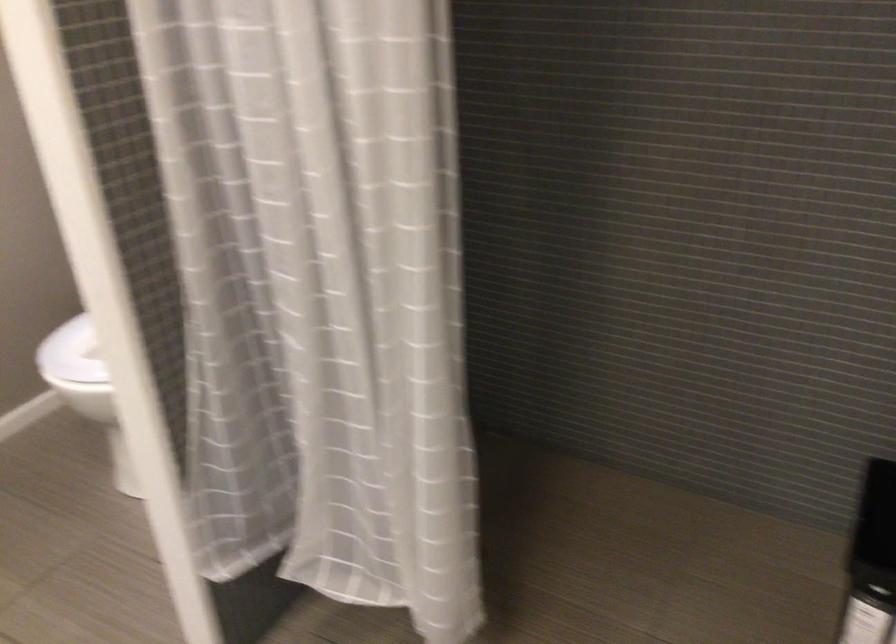
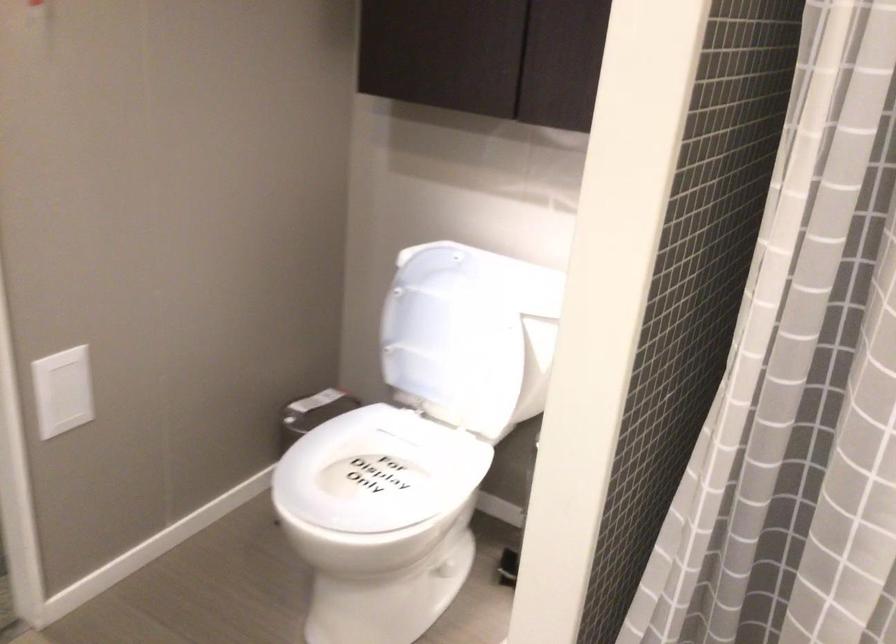
Which direction would the cameraman need to move to produce the second image?

The cameraman moved toward left, forward.